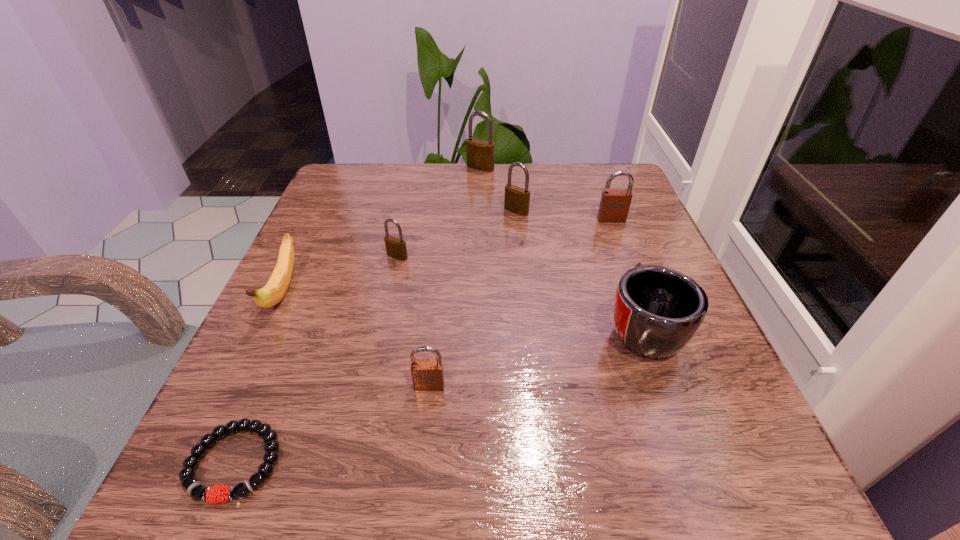
Find the location of a particular element. The height and width of the screenshot is (540, 960). the tallest object is located at coordinates (480, 154).

Where is `the farthest padlock`? the farthest padlock is located at coordinates (480, 154).

At what (x,y) coordinates should I click in order to perform the action: click on the third object from right to left. Please return your answer as a coordinate pair (x, y). The image size is (960, 540). Looking at the image, I should click on (517, 199).

Identify the location of the second farthest brass padlock. (517, 199).

This screenshot has height=540, width=960. I want to click on the bigger brown padlock, so click(x=614, y=206).

Where is `the right brown padlock`? Image resolution: width=960 pixels, height=540 pixels. the right brown padlock is located at coordinates (614, 206).

The image size is (960, 540). I want to click on mug, so click(657, 310).

Identify the location of the nearest brass padlock. (396, 248).

The image size is (960, 540). I want to click on the second nearest padlock, so click(x=396, y=248).

The width and height of the screenshot is (960, 540). I want to click on the fourth padlock from right to left, so click(x=427, y=374).